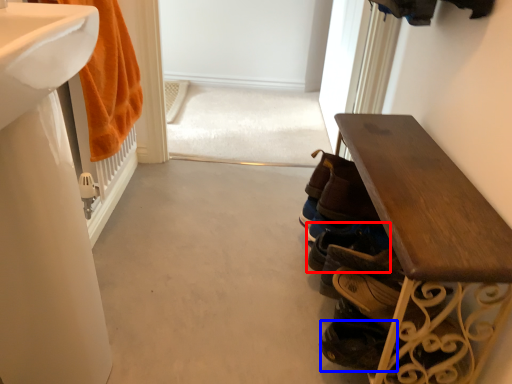
Question: Which point is closer to the camera, footwear (highlighted by a red box) or shoe (highlighted by a blue box)?

Choices:
 (A) footwear
 (B) shoe

Answer: (B)